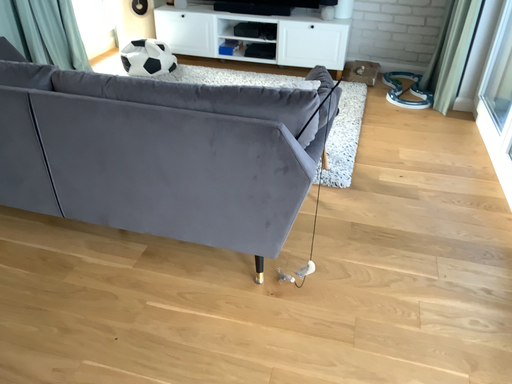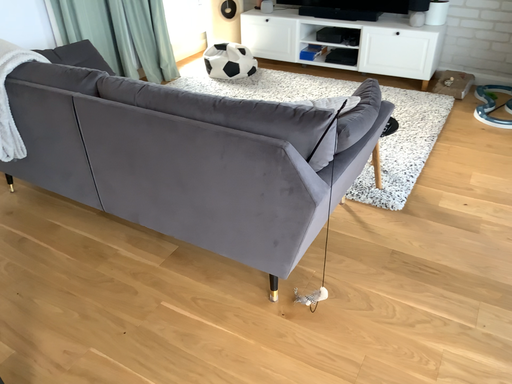
Question: How did the camera likely rotate when shooting the video?

Choices:
 (A) rotated left
 (B) rotated right

Answer: (A)